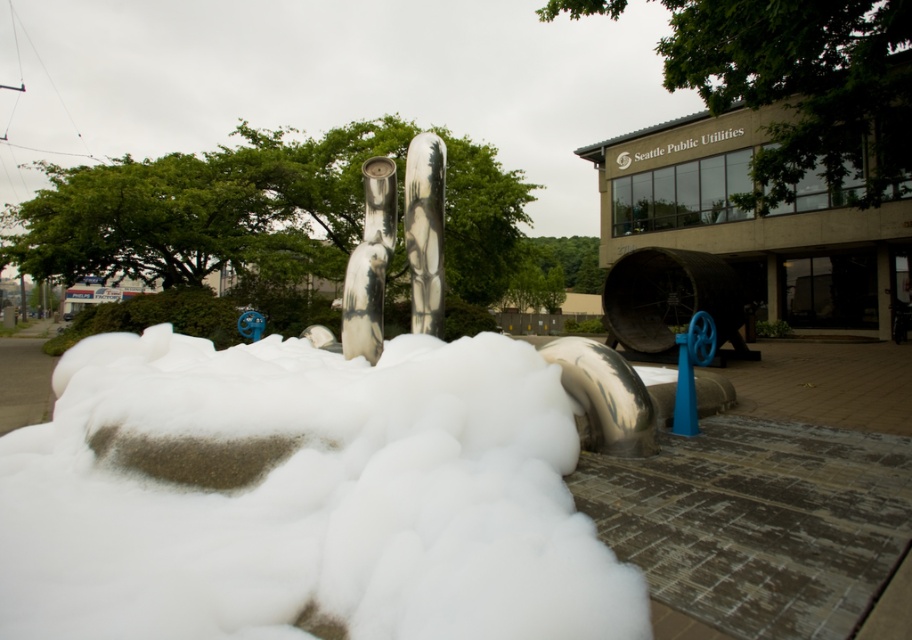
How far apart are white fluffy foam at center and brushed metal sculpture at center?

white fluffy foam at center is 8.32 feet from brushed metal sculpture at center.

Describe the element at coordinates (307, 497) in the screenshot. I see `white fluffy foam at center` at that location.

This screenshot has width=912, height=640. Identify the location of white fluffy foam at center. (307, 497).

Does shiny metallic pipe at center appear on the right side of brushed metal sculpture at center?

Incorrect, shiny metallic pipe at center is not on the right side of brushed metal sculpture at center.

Is shiny metallic pipe at center taller than brushed metal sculpture at center?

No.

This screenshot has width=912, height=640. What are the coordinates of `shiny metallic pipe at center` in the screenshot? It's located at (369, 262).

Which is more to the right, white fluffy foam at center or shiny metallic pipe at center?

shiny metallic pipe at center is more to the right.

What are the coordinates of `white fluffy foam at center` in the screenshot? It's located at (307, 497).